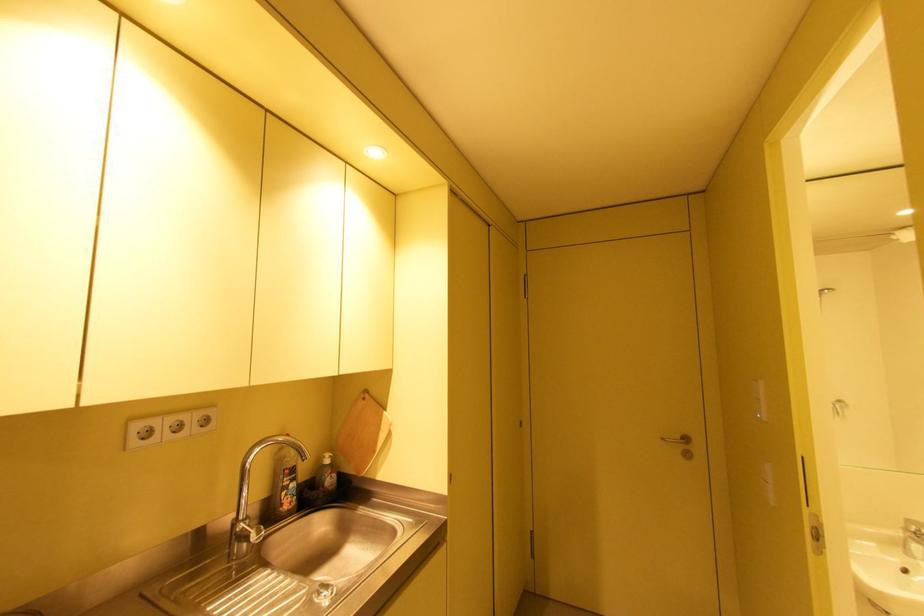
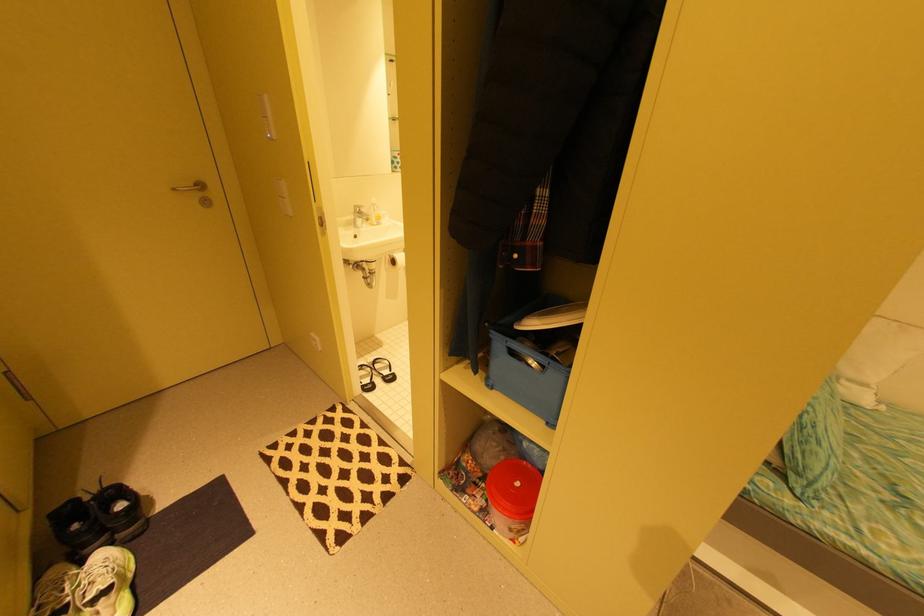
How did the camera likely rotate?

The rotation direction of the camera is right-down.